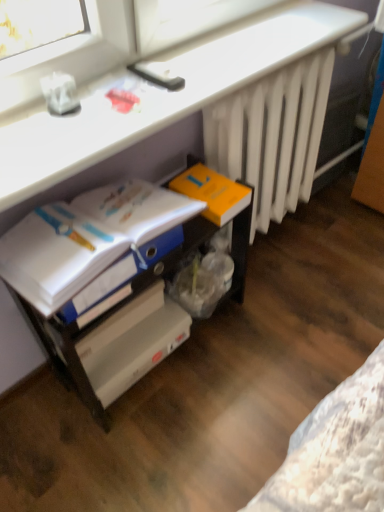
The image size is (384, 512). In order to click on empty space that is ontop of white plastic computer at lower left in this screenshot , I will do `click(182, 70)`.